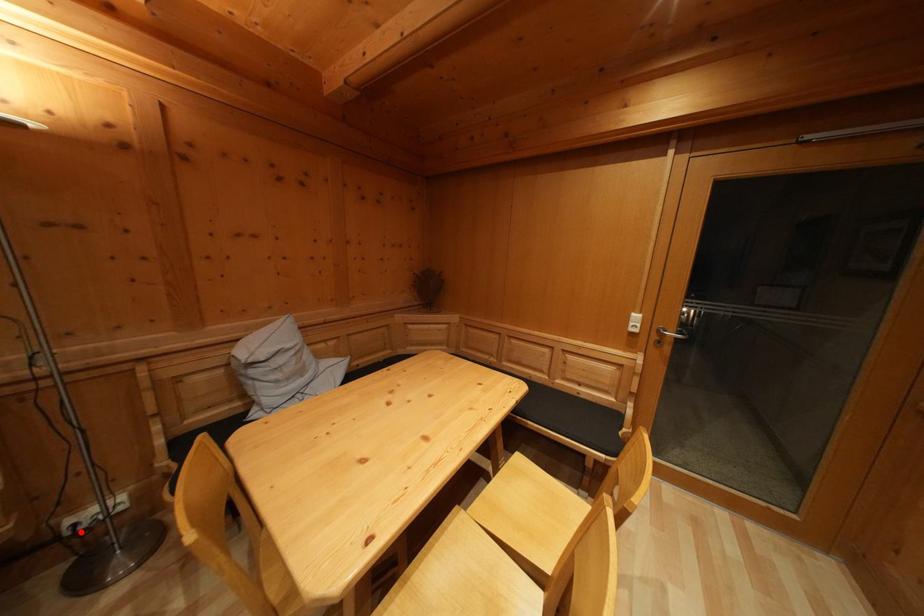
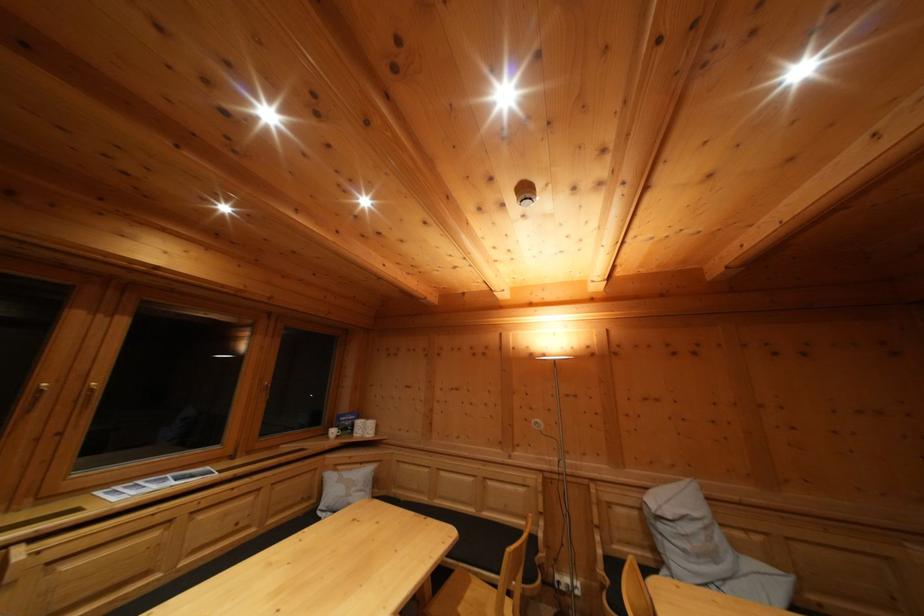
Question: I am providing you with two images of the same scene from different viewpoints. Given a red point in image1, look at the same physical point in image2. Is it:

Choices:
 (A) Closer to the viewpoint
 (B) Farther from the viewpoint

Answer: (A)